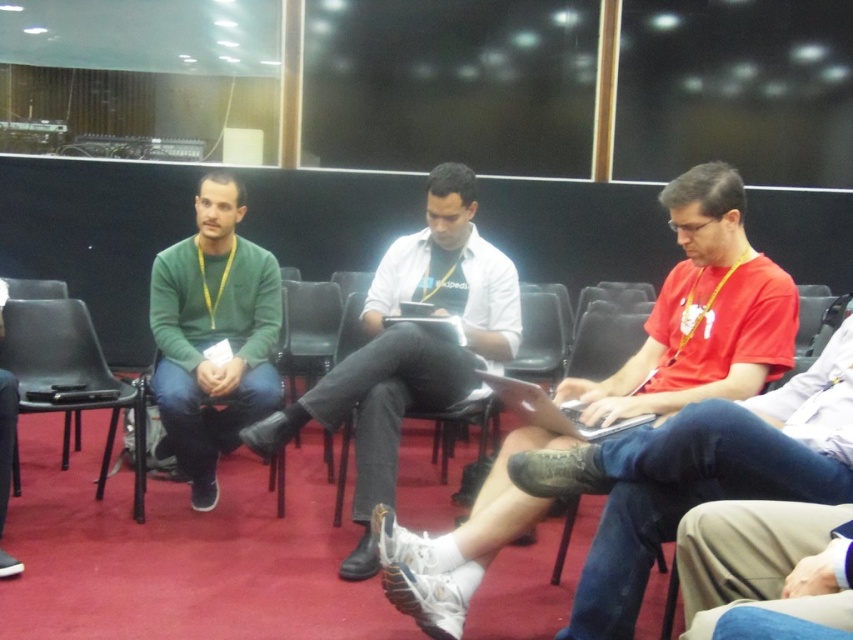
You are a photographer who needs to capture a clear photo of the matte red shirt at center during a presentation. The camera you are using has a minimum focus distance of 5 feet. Can you take the photo without moving closer?

The matte red shirt at center and camera are 5.64 feet apart from each other. Since the minimum focus distance is 5 feet, the photographer can take the photo without moving closer because 5.64 feet is within the camera s capability.

You are organizing a seating arrangement for an event and need to place the matte red shirt at center and the black plastic chair at left. Given their sizes, which object would require more space in the seating plan?

The black plastic chair at left requires more space in the seating plan because the matte red shirt at center occupies less space than it.

You are standing at the entrance of the conference room and see two points marked in the scene. Which point, point (57,342) or point (447,387), is closer to you?

Point (447,387) is closer to you because point (57,342) is behind it.